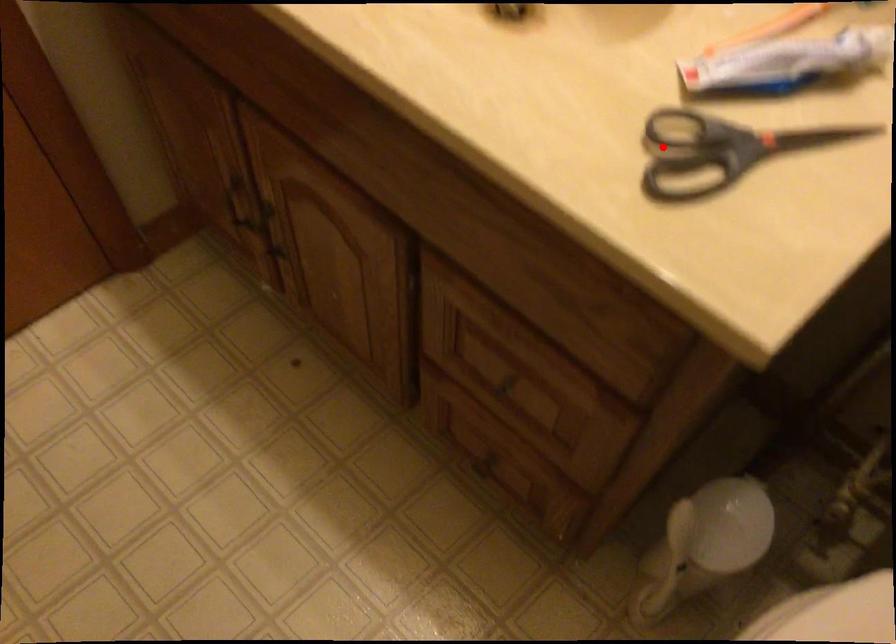
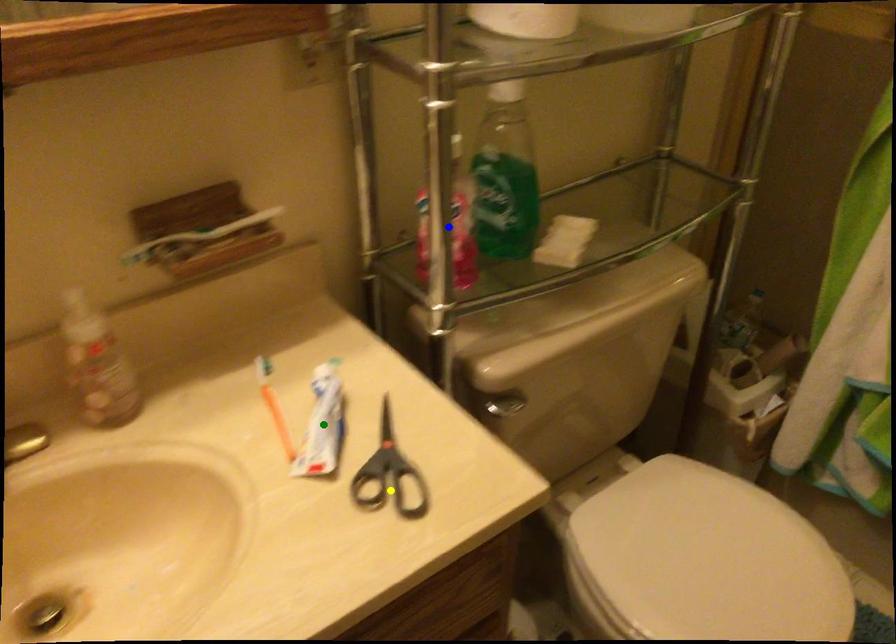
Question: I am providing you with two images of the same scene from different viewpoints. A red point is marked on the first image. You are given multiple points on the second image. Which point in image 2 represents the same 3d spot as the red point in image 1?

Choices:
 (A) blue point
 (B) yellow point
 (C) green point

Answer: (B)